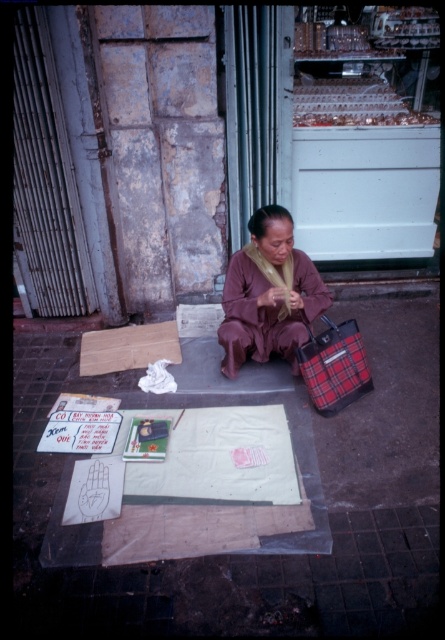
You are a pedestrian walking towards the smooth concrete surface at center and the brown matte robe at center. Which object will you encounter first?

The smooth concrete surface at center is closer to the viewer than the brown matte robe at center, so you will encounter the smooth concrete surface at center first.

What is the location of the point with coordinates (x=261, y=556) in the image?

The point with coordinates (x=261, y=556) is located on the smooth concrete surface at center.

You are a delivery person who needs to place a small package between the smooth concrete surface at center and the brown matte robe at center. Can you fit it there?

The smooth concrete surface at center and the brown matte robe at center are 27.05 inches apart from each other, so yes, the small package can fit between them since the space is sufficient.